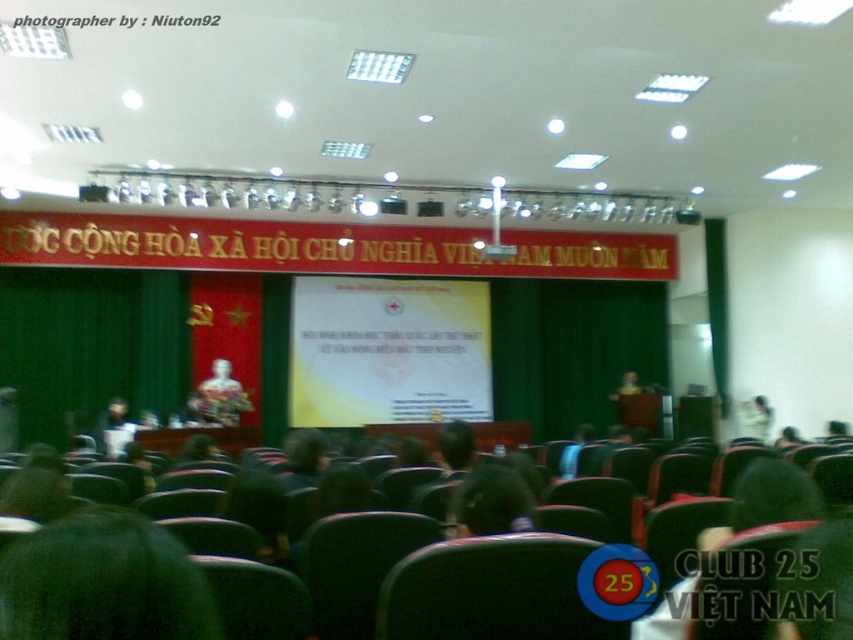
Based on the photo, you are an event organizer setting up for a presentation. You notice a dark green leaf at lower left and a yellow matte projection screen at center. Which object is closer to the front of the stage?

The dark green leaf at lower left is behind the yellow matte projection screen at center, so the yellow matte projection screen at center is closer to the front of the stage.

You are an event organizer setting up for a presentation. You notice the yellow matte projection screen at center and the dark green leaf at lower left. Which object is closer to the stage area?

The dark green leaf at lower left is closer to the stage area because it is positioned above the yellow matte projection screen at center, which is placed under it.

You are a photographer standing at the camera position. You need to capture a clear image of the yellow matte projection screen at center. Considering the distance between the camera and the screen, will you be able to focus on the screen without any issues?

The yellow matte projection screen at center and camera are 10.99 meters apart from each other. Since most modern cameras can focus up to several hundred meters, the distance of 10.99 meters is well within the focusing range. Therefore, the photographer can focus on the yellow matte projection screen at center without any issues.